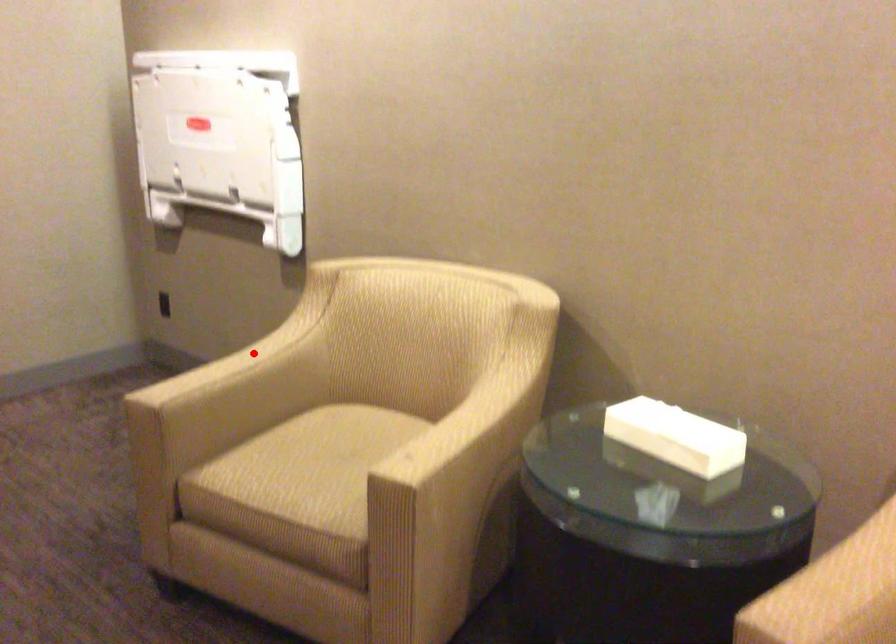
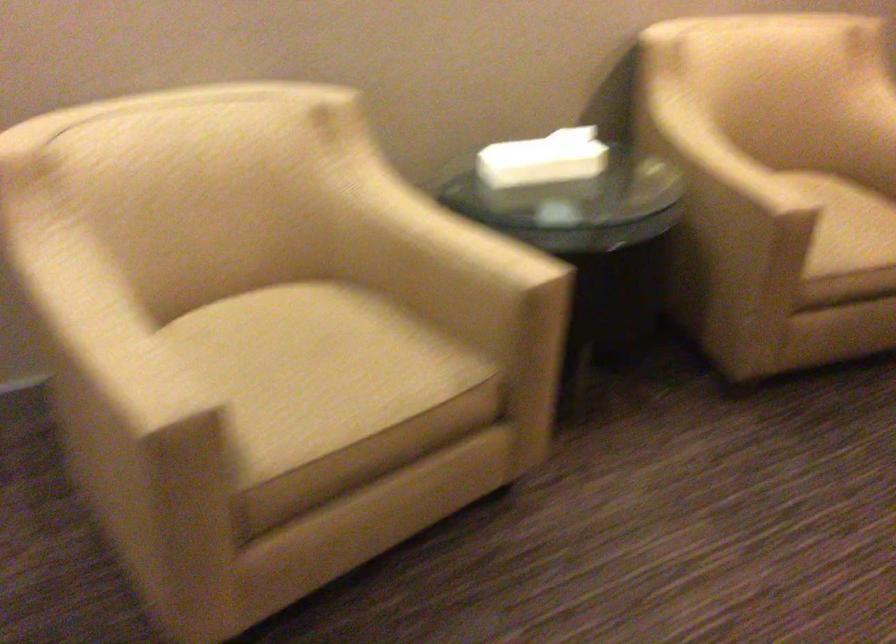
Question: I am providing you with two images of the same scene from different viewpoints. Image1 has a red point marked. In image2, the corresponding 3D location appears at what relative position? Reply with the corresponding letter.

Choices:
 (A) Closer
 (B) Farther

Answer: (A)